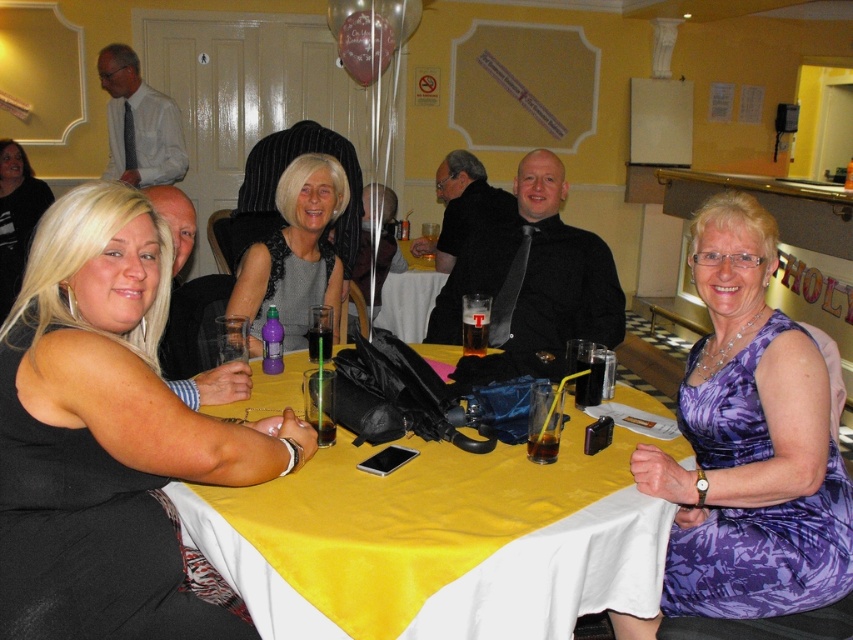
Where is the yellow satin tablecloth at center located in the image?

The yellow satin tablecloth at center is located at the point with coordinates 0.847 and 0.513.

You are a server at the restaurant and need to deliver a tray of drinks to the table. The tray is 1.3 meters long. Can you place it on the yellow satin tablecloth at center without it hanging off the edge?

The yellow satin tablecloth at center is 1.20 meters away from viewer. Since the tray is 1.3 meters long, it might not fit if the tablecloth is shorter than the tray. However, the distance from the viewer does not indicate the tablecloth size. More information about the tablecloth dimensions is needed to determine if the tray will fit.

You are a photographer at the event and want to capture a photo of the black satin dress at center and the blonde hair at lower left. Which object is wider in the image?

The black satin dress at center is wider than the blonde hair at lower left.